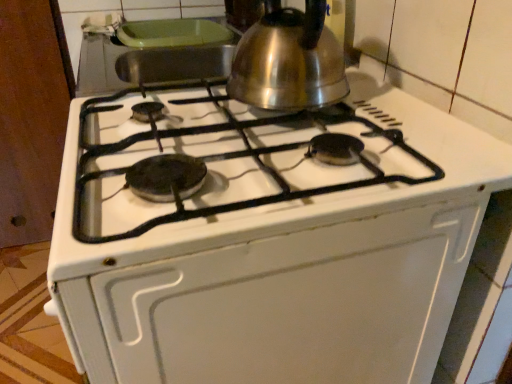
Question: Does white matte oven at center have a lesser height compared to satin silver kettle at upper center?

Choices:
 (A) yes
 (B) no

Answer: (B)

Question: Is satin silver kettle at upper center completely or partially inside white matte oven at center?

Choices:
 (A) yes
 (B) no

Answer: (B)

Question: From the image's perspective, is white matte oven at center located beneath satin silver kettle at upper center?

Choices:
 (A) no
 (B) yes

Answer: (B)

Question: Is white matte oven at center far away from satin silver kettle at upper center?

Choices:
 (A) no
 (B) yes

Answer: (A)

Question: Is white matte oven at center outside satin silver kettle at upper center?

Choices:
 (A) yes
 (B) no

Answer: (A)

Question: From a real-world perspective, is white matte oven at center physically above satin silver kettle at upper center?

Choices:
 (A) yes
 (B) no

Answer: (B)

Question: Is satin silver kettle at upper center behind white matte oven at center?

Choices:
 (A) yes
 (B) no

Answer: (A)

Question: Can we say satin silver kettle at upper center lies outside white matte oven at center?

Choices:
 (A) no
 (B) yes

Answer: (B)

Question: Considering the relative sizes of satin silver kettle at upper center and white matte oven at center in the image provided, is satin silver kettle at upper center bigger than white matte oven at center?

Choices:
 (A) no
 (B) yes

Answer: (A)

Question: Is white matte oven at center at the back of satin silver kettle at upper center?

Choices:
 (A) no
 (B) yes

Answer: (A)

Question: Does satin silver kettle at upper center have a smaller size compared to white matte oven at center?

Choices:
 (A) yes
 (B) no

Answer: (A)

Question: From the image's perspective, is satin silver kettle at upper center beneath white matte oven at center?

Choices:
 (A) no
 (B) yes

Answer: (A)

Question: Does point (261, 81) appear closer or farther from the camera than point (462, 218)?

Choices:
 (A) closer
 (B) farther

Answer: (B)